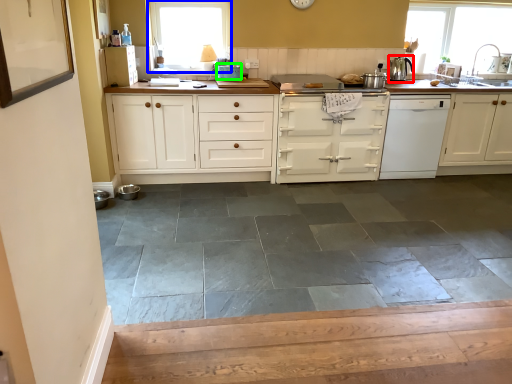
Question: Which object is the farthest from kitchen appliance (highlighted by a red box)? Choose among these: window (highlighted by a blue box) or appliance (highlighted by a green box).

Choices:
 (A) window
 (B) appliance

Answer: (A)